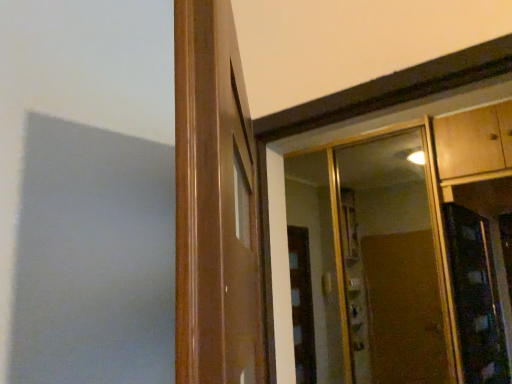
Question: Considering the relative positions of wooden door frame at center and clear glass mirror at upper right in the image provided, is wooden door frame at center to the left or to the right of clear glass mirror at upper right?

Choices:
 (A) right
 (B) left

Answer: (B)

Question: In terms of width, does wooden door frame at center look wider or thinner when compared to clear glass mirror at upper right?

Choices:
 (A) wide
 (B) thin

Answer: (A)

Question: Which object is positioned closest to the wooden door frame at center?

Choices:
 (A) wooden cabinet at upper right
 (B) clear glass mirror at upper right

Answer: (A)

Question: Estimate the real-world distances between objects in this image. Which object is closer to the clear glass mirror at upper right?

Choices:
 (A) wooden door frame at center
 (B) wooden cabinet at upper right

Answer: (B)